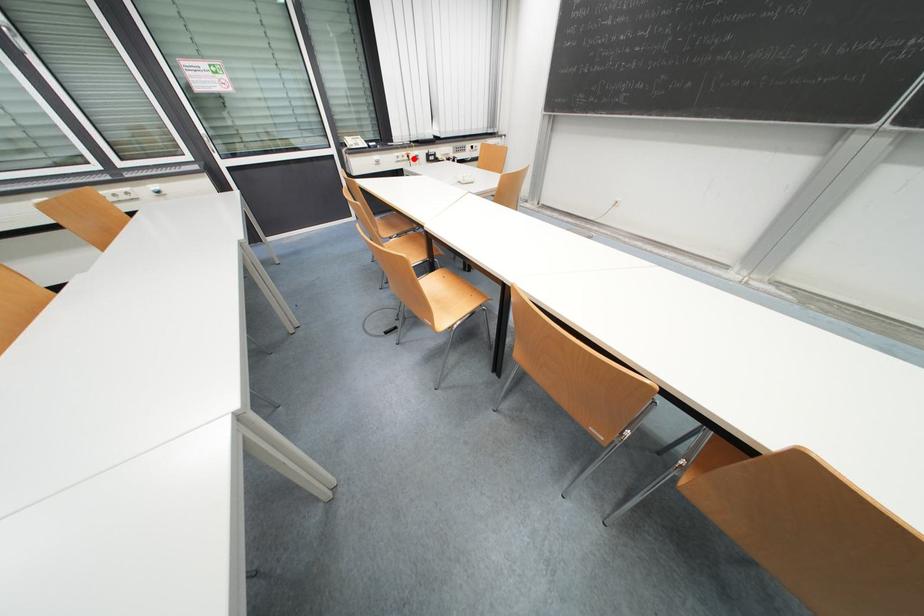
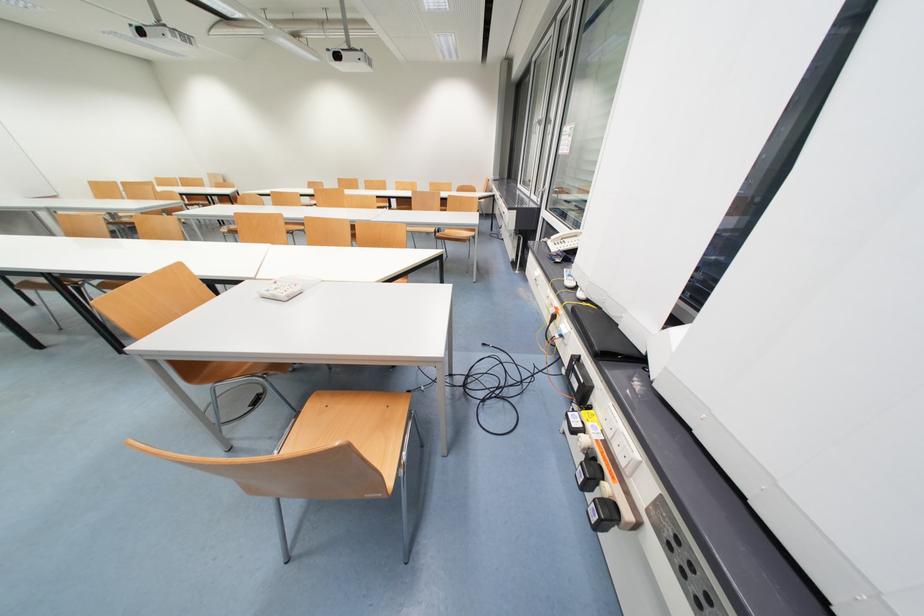
Question: I am providing you with two images of the same scene from different viewpoints. A red point is marked on the first image. Is the red point's position out of view in image 2?

Choices:
 (A) Yes
 (B) No

Answer: (B)